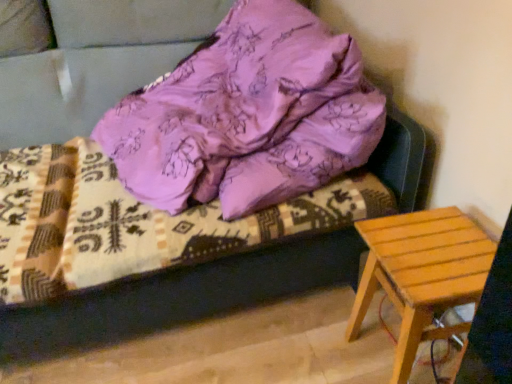
This screenshot has width=512, height=384. Describe the element at coordinates (135, 222) in the screenshot. I see `purple satin bedding at upper center` at that location.

Describe the element at coordinates (421, 274) in the screenshot. This screenshot has height=384, width=512. I see `light brown wooden stool at lower right` at that location.

Where is `light brown wooden stool at lower right`? The height and width of the screenshot is (384, 512). light brown wooden stool at lower right is located at coordinates (421, 274).

Describe the element at coordinates (248, 116) in the screenshot. The height and width of the screenshot is (384, 512). I see `purple satin pillow at upper center` at that location.

The image size is (512, 384). I want to click on purple satin bedding at upper center, so click(x=135, y=222).

From the image's perspective, is purple satin pillow at upper center located above or below purple satin bedding at upper center?

purple satin pillow at upper center is situated higher than purple satin bedding at upper center in the image.

Can you see purple satin pillow at upper center touching purple satin bedding at upper center?

purple satin pillow at upper center and purple satin bedding at upper center are clearly separated.

Is purple satin pillow at upper center not inside purple satin bedding at upper center?

Absolutely, purple satin pillow at upper center is external to purple satin bedding at upper center.

Is purple satin pillow at upper center aimed at purple satin bedding at upper center?

Yes.

Is purple satin bedding at upper center looking in the opposite direction of light brown wooden stool at lower right?

No, purple satin bedding at upper center's orientation is not away from light brown wooden stool at lower right.

Is purple satin bedding at upper center spatially inside light brown wooden stool at lower right, or outside of it?

The correct answer is: outside.

Image resolution: width=512 pixels, height=384 pixels. Find the location of `bedding above the light brown wooden stool at lower right (from the image's perspective)`. bedding above the light brown wooden stool at lower right (from the image's perspective) is located at coordinates (135, 222).

Considering the relative positions of purple satin bedding at upper center and light brown wooden stool at lower right in the image provided, is purple satin bedding at upper center to the left of light brown wooden stool at lower right from the viewer's perspective?

Indeed, purple satin bedding at upper center is positioned on the left side of light brown wooden stool at lower right.

Does light brown wooden stool at lower right have a greater width compared to purple satin bedding at upper center?

In fact, light brown wooden stool at lower right might be narrower than purple satin bedding at upper center.

Locate an element on the screen. bedding lying on the left of light brown wooden stool at lower right is located at coordinates (135, 222).

From a real-world perspective, which object rests below the other?

light brown wooden stool at lower right is physically lower.

Looking at the image, does light brown wooden stool at lower right seem bigger or smaller compared to purple satin bedding at upper center?

In the image, light brown wooden stool at lower right appears to be smaller than purple satin bedding at upper center.

Can you tell me how much purple satin pillow at upper center and light brown wooden stool at lower right differ in facing direction?

The facing directions of purple satin pillow at upper center and light brown wooden stool at lower right are 14.5 degrees apart.

Considering the points (267, 73) and (440, 306), which point is behind, point (267, 73) or point (440, 306)?

Point (267, 73)

Would you say purple satin pillow at upper center contains light brown wooden stool at lower right?

No.

Considering the sizes of objects purple satin pillow at upper center and light brown wooden stool at lower right in the image provided, who is bigger, purple satin pillow at upper center or light brown wooden stool at lower right?

purple satin pillow at upper center is bigger.

Is purple satin bedding at upper center not close to purple satin pillow at upper center?

purple satin bedding at upper center is near purple satin pillow at upper center, not far away.

Between purple satin bedding at upper center and purple satin pillow at upper center, which one has less height?

With less height is purple satin bedding at upper center.

From the image's perspective, is purple satin bedding at upper center located above or below purple satin pillow at upper center?

From the image's perspective, purple satin bedding at upper center appears below purple satin pillow at upper center.

Which point is more forward, (138, 212) or (288, 156)?

Point (288, 156)

Who is taller, light brown wooden stool at lower right or purple satin pillow at upper center?

purple satin pillow at upper center.

What's the angular difference between light brown wooden stool at lower right and purple satin pillow at upper center's facing directions?

14.5 degrees separate the facing orientations of light brown wooden stool at lower right and purple satin pillow at upper center.

Between light brown wooden stool at lower right and purple satin pillow at upper center, which one has larger width?

Wider between the two is purple satin pillow at upper center.

Is light brown wooden stool at lower right not close to purple satin pillow at upper center?

No, there isn't a large distance between light brown wooden stool at lower right and purple satin pillow at upper center.

This screenshot has width=512, height=384. There is a purple satin bedding at upper center. In order to click on pillow above it (from a real-world perspective) in this screenshot , I will do `click(248, 116)`.

Locate an element on the screen. The width and height of the screenshot is (512, 384). bedding behind the light brown wooden stool at lower right is located at coordinates (135, 222).

When comparing their distances from purple satin bedding at upper center, does light brown wooden stool at lower right or purple satin pillow at upper center seem closer?

purple satin pillow at upper center is positioned closer to the anchor purple satin bedding at upper center.

Which object lies further to the anchor point light brown wooden stool at lower right, purple satin bedding at upper center or purple satin pillow at upper center?

purple satin pillow at upper center is further to light brown wooden stool at lower right.

Which object lies further to the anchor point purple satin pillow at upper center, purple satin bedding at upper center or light brown wooden stool at lower right?

Among the two, light brown wooden stool at lower right is located further to purple satin pillow at upper center.

Considering their positions, is light brown wooden stool at lower right positioned closer to purple satin pillow at upper center than purple satin bedding at upper center?

The object closer to purple satin pillow at upper center is purple satin bedding at upper center.

Looking at the image, which one is located closer to purple satin bedding at upper center, purple satin pillow at upper center or light brown wooden stool at lower right?

purple satin pillow at upper center is closer to purple satin bedding at upper center.

Based on their spatial positions, is purple satin pillow at upper center or purple satin bedding at upper center further from light brown wooden stool at lower right?

Based on the image, purple satin pillow at upper center appears to be further to light brown wooden stool at lower right.

This screenshot has height=384, width=512. What are the coordinates of `pillow between purple satin bedding at upper center and light brown wooden stool at lower right from left to right` in the screenshot? It's located at (248, 116).